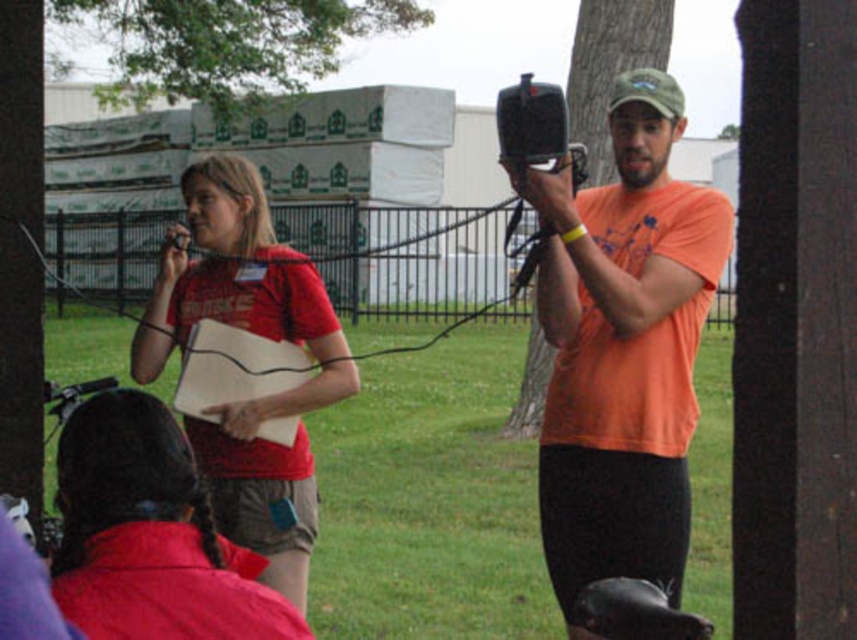
Which of these two, orange matte t-shirt at center or matte red shirt at center, stands shorter?

matte red shirt at center is shorter.

Identify the location of orange matte t-shirt at center. (620, 340).

Does matte red shirt at center appear over brown textured tree trunk at upper center?

No.

Which is more to the left, matte red shirt at center or brown textured tree trunk at upper center?

From the viewer's perspective, matte red shirt at center appears more on the left side.

Is point (303, 522) positioned in front of point (613, 90)?

Yes, it is in front of point (613, 90).

Locate an element on the screen. This screenshot has width=857, height=640. matte red shirt at center is located at coordinates (256, 333).

Who is more forward, (255, 324) or (174, 604)?

Point (174, 604) is more forward.

Measure the distance between matte red shirt at center and camera.

matte red shirt at center and camera are 12.58 feet apart.

Who is more forward, (301,404) or (112,516)?

Positioned in front is point (112,516).

I want to click on matte red shirt at center, so click(x=256, y=333).